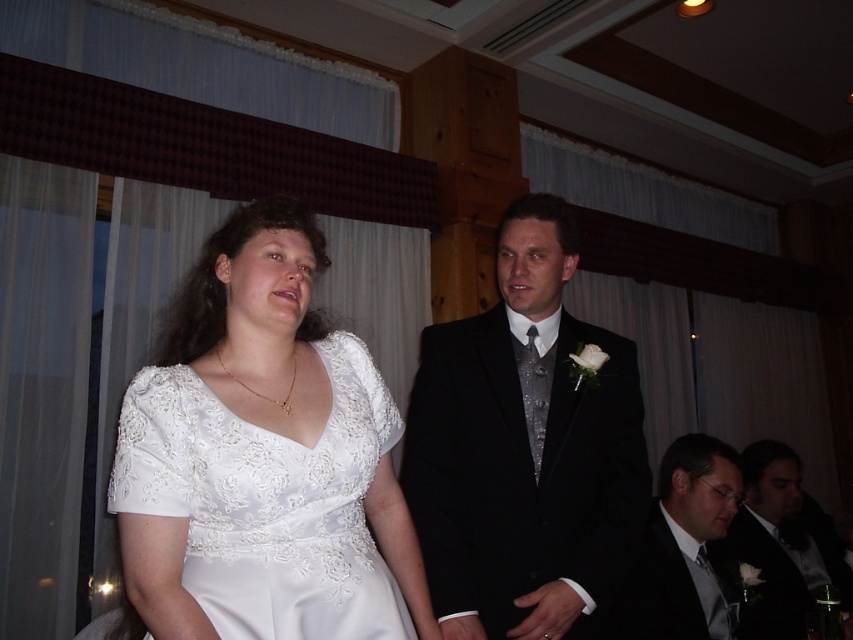
Question: Which object appears farthest from the camera in this image?

Choices:
 (A) matte black suit at lower right
 (B) white satin dress at center

Answer: (A)

Question: Does white satin dress at center appear on the left side of matte black suit at lower right?

Choices:
 (A) yes
 (B) no

Answer: (A)

Question: Which object is closer to the camera taking this photo?

Choices:
 (A) matte black suit at lower right
 (B) white satin dress at center
 (C) black satin suit at center

Answer: (B)

Question: Can you confirm if black satin suit at center is bigger than matte black suit at lower right?

Choices:
 (A) yes
 (B) no

Answer: (B)

Question: Does white satin dress at center have a larger size compared to black satin suit at center?

Choices:
 (A) yes
 (B) no

Answer: (B)

Question: Which of these objects is positioned farthest from the matte black suit at lower right?

Choices:
 (A) white satin dress at center
 (B) black satin suit at center

Answer: (A)